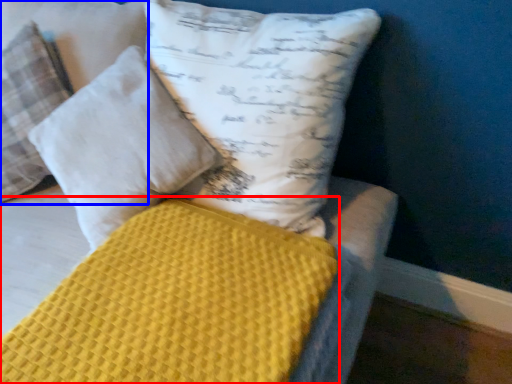
Question: Which point is further to the camera, mattress (highlighted by a red box) or pillow (highlighted by a blue box)?

Choices:
 (A) mattress
 (B) pillow

Answer: (B)